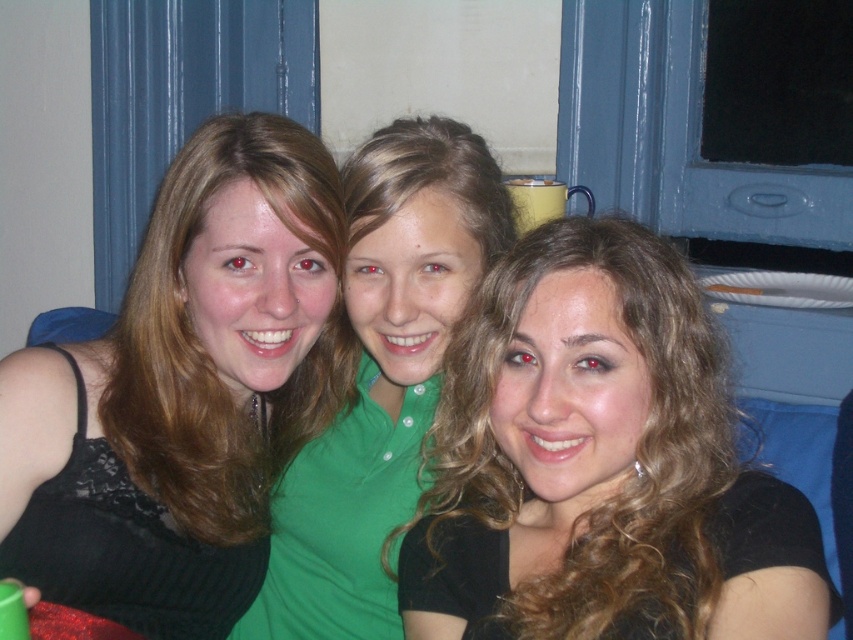
Question: Which of the following is the closest to the observer?

Choices:
 (A) matte black tank top at left
 (B) green matte shirt at center
 (C) black matte hair at center

Answer: (C)

Question: Is matte black tank top at left closer to the viewer compared to green matte shirt at center?

Choices:
 (A) no
 (B) yes

Answer: (B)

Question: Can you confirm if matte black tank top at left is positioned above green matte shirt at center?

Choices:
 (A) no
 (B) yes

Answer: (B)

Question: Which object appears closest to the camera in this image?

Choices:
 (A) matte black tank top at left
 (B) black matte hair at center

Answer: (B)

Question: Considering the real-world distances, which object is closest to the green matte shirt at center?

Choices:
 (A) black matte hair at center
 (B) matte black tank top at left

Answer: (B)

Question: Considering the relative positions of matte black tank top at left and black matte hair at center in the image provided, where is matte black tank top at left located with respect to black matte hair at center?

Choices:
 (A) left
 (B) right

Answer: (A)